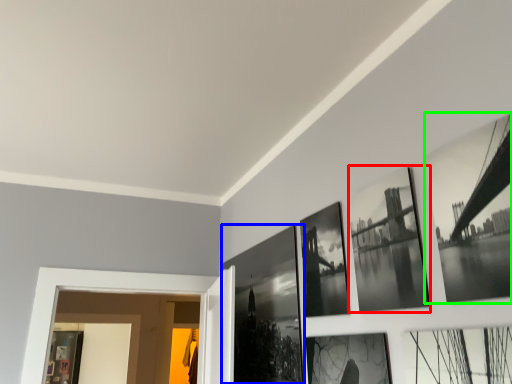
Question: Which is nearer to the picture frame (highlighted by a red box)? picture frame (highlighted by a blue box) or picture frame (highlighted by a green box).

Choices:
 (A) picture frame
 (B) picture frame

Answer: (B)